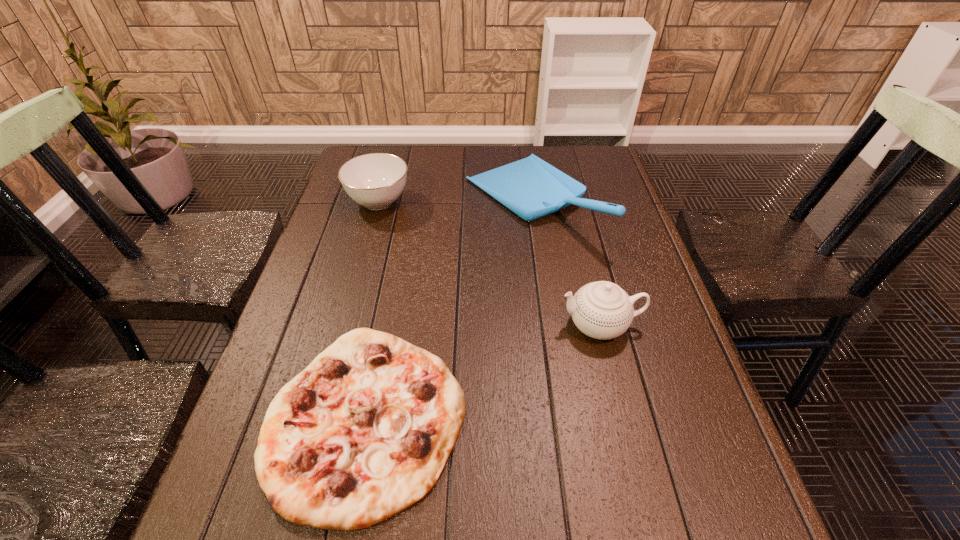
The image size is (960, 540). Find the location of `free space that satisfies the following two spatial constraints: 1. on the spout of the nearer chinaware; 2. on the front side of the shortest object`. free space that satisfies the following two spatial constraints: 1. on the spout of the nearer chinaware; 2. on the front side of the shortest object is located at coordinates (623, 418).